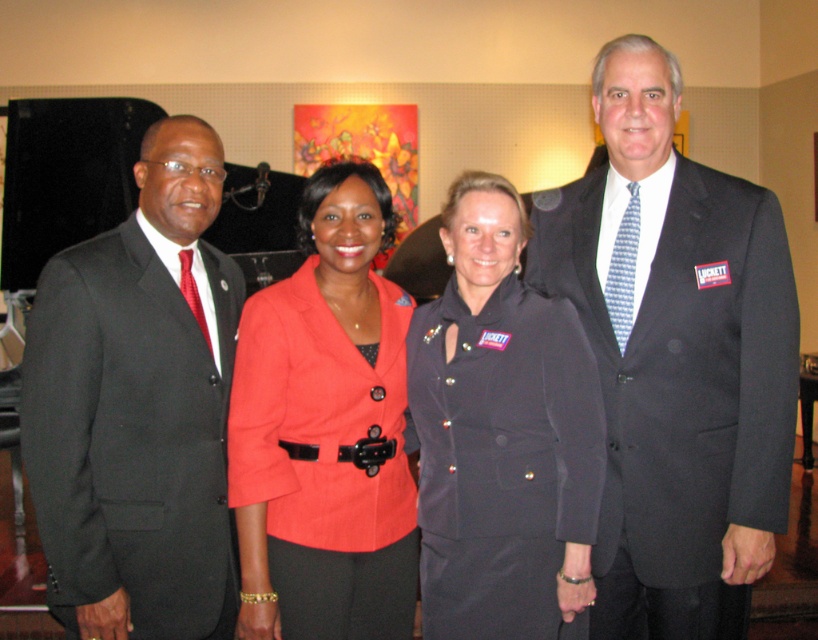
You are organizing a photo shoot and need to ensure that the dark gray suit at center and the matte black blazer at center are visible in the frame. Given their sizes, which one should you focus on to ensure both are in the frame without cropping?

The dark gray suit at center is bigger than the matte black blazer at center, so you should focus on framing the larger dark gray suit at center to accommodate both items in the shot.

You are at a networking event and want to approach the dark gray suit at center and the matte black blazer at center. Which one should you walk towards if you want to greet the person on the left side of the group first?

You should walk towards the matte black blazer at center because it is positioned to the left of the dark gray suit at center, so greeting them first aligns with the left side of the group.

You are a photographer at a formal event. You need to capture a photo of the matte black suit at left and the dark gray suit at center without any obstruction. Given their current positions, which person should move forward slightly to ensure both are visible clearly?

The matte black suit at left is behind the dark gray suit at center, so the person wearing the dark gray suit at center should move forward slightly to allow the matte black suit at left to be visible without obstruction.